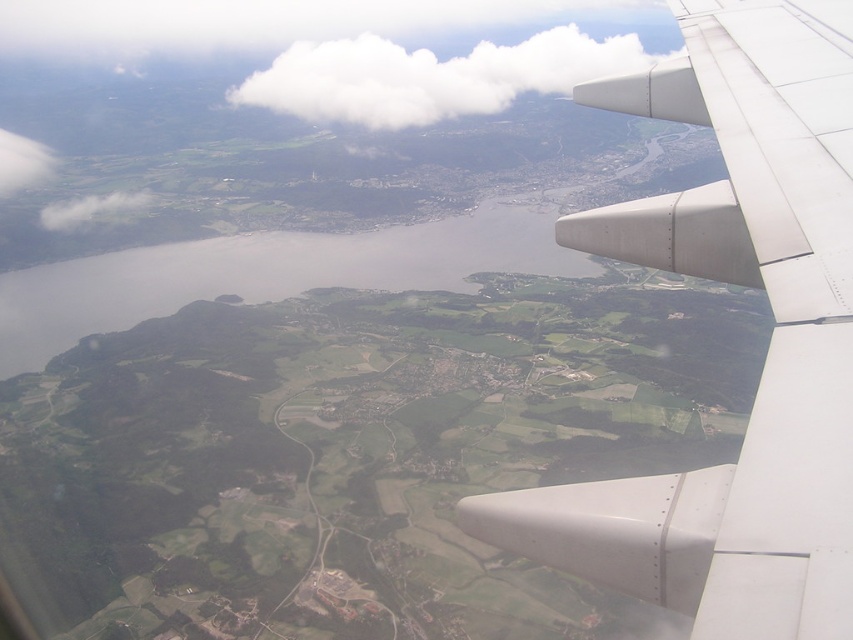
You are a passenger looking out the airplane window. You see the metallic gray wing at right and the white fluffy cloud at upper center. Which object is closer to the left side of the window?

The metallic gray wing at right is to the left of the white fluffy cloud at upper center, so it is closer to the left side of the window.

You are a passenger looking out the airplane window. You see the metallic gray wing at right and the white fluffy cloud at upper center. Which object is closer to you?

The metallic gray wing at right is closer to you because it is in front of the white fluffy cloud at upper center.

Looking at this image, you are a pilot looking out of the airplane window. You notice the metallic gray wing at right and the white fluffy cloud at upper center. Which object appears narrower when viewed from your current position?

The metallic gray wing at right appears narrower than the white fluffy cloud at upper center because it is thinner.